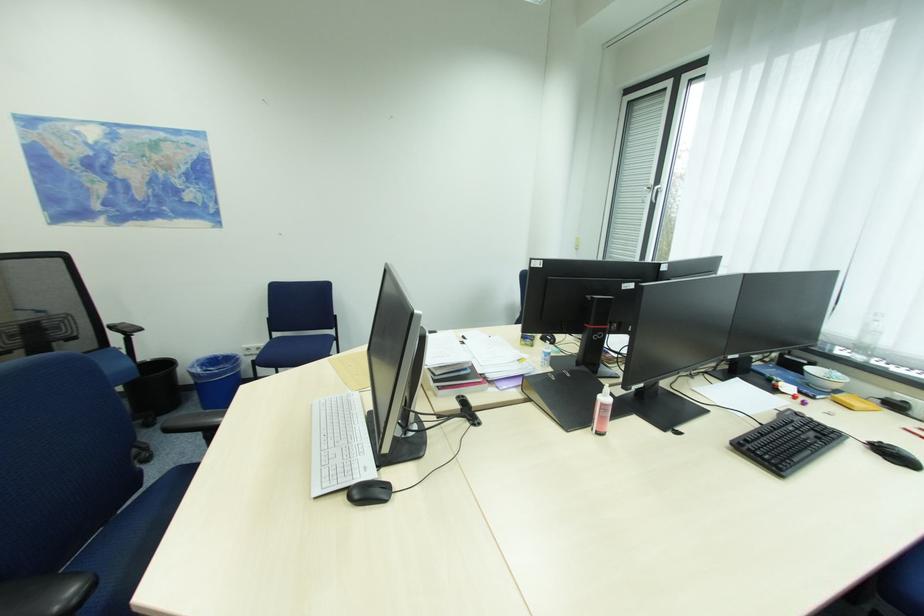
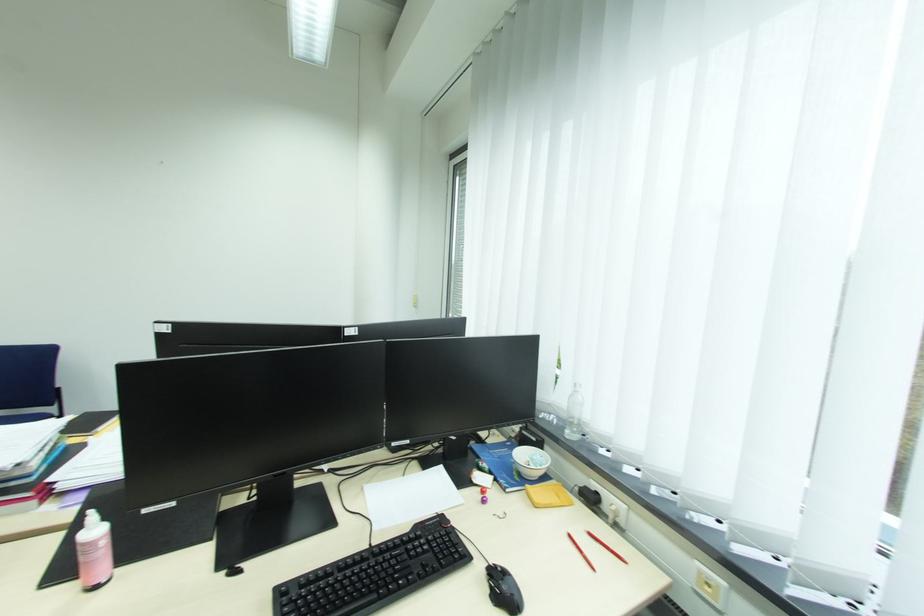
Question: Which direction would the cameraman need to move to produce the second image? Reply with the corresponding letter.

Choices:
 (A) Left
 (B) Right
 (C) Forward
 (D) Backward

Answer: (B)